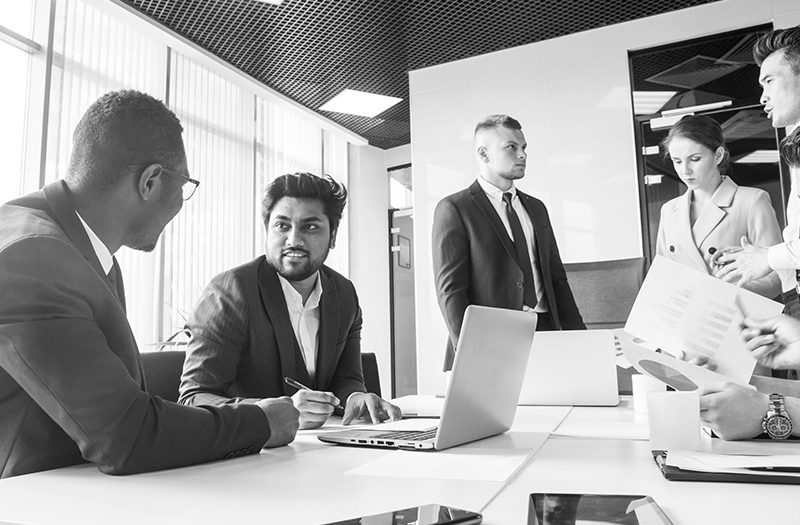
Locate an element on the screen. The image size is (800, 525). window is located at coordinates (212, 158).